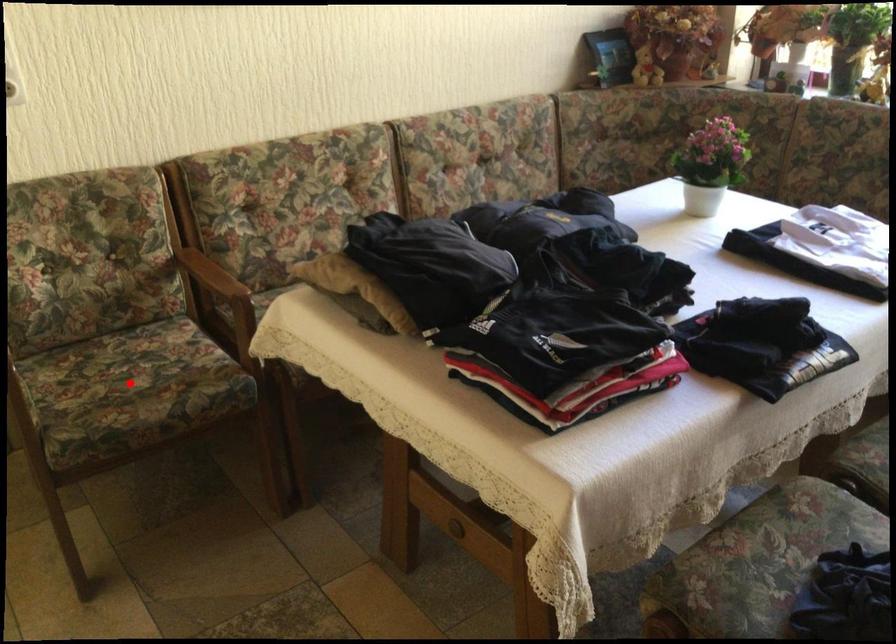
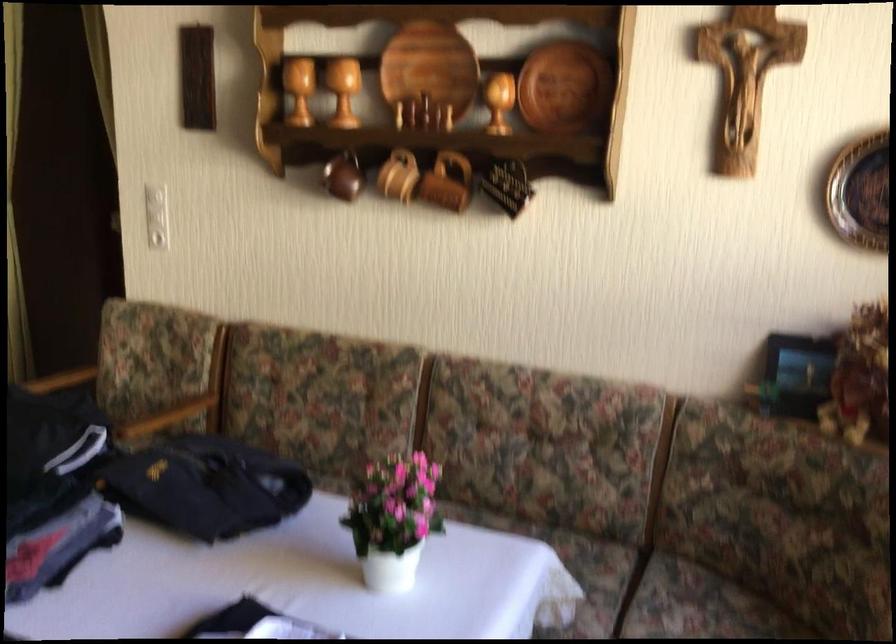
Question: I am providing you with two images of the same scene from different viewpoints. A red point is marked on the first image. At the location where the point appears in image 1, is it still visible in image 2?

Choices:
 (A) Yes
 (B) No

Answer: (B)